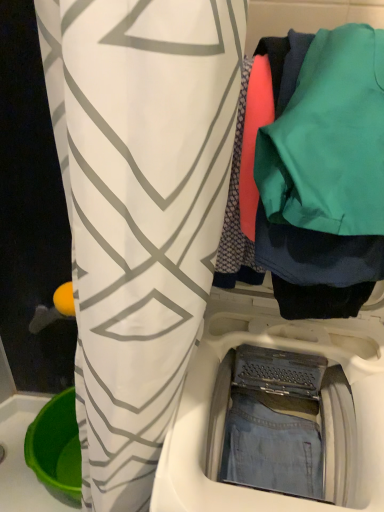
Question: Could you tell me if teal fabric at upper right is turned towards denim fabric washing machine at center?

Choices:
 (A) no
 (B) yes

Answer: (A)

Question: Considering the relative sizes of teal fabric at upper right and denim fabric washing machine at center in the image provided, is teal fabric at upper right taller than denim fabric washing machine at center?

Choices:
 (A) yes
 (B) no

Answer: (B)

Question: Can you confirm if teal fabric at upper right is thinner than denim fabric washing machine at center?

Choices:
 (A) no
 (B) yes

Answer: (B)

Question: Is teal fabric at upper right next to denim fabric washing machine at center?

Choices:
 (A) no
 (B) yes

Answer: (A)

Question: Considering the relative positions of teal fabric at upper right and denim fabric washing machine at center in the image provided, is teal fabric at upper right to the right of denim fabric washing machine at center from the viewer's perspective?

Choices:
 (A) no
 (B) yes

Answer: (B)

Question: Is teal fabric at upper right further to the viewer compared to denim fabric washing machine at center?

Choices:
 (A) no
 (B) yes

Answer: (A)

Question: From the image's perspective, is denim fabric washing machine at center over teal fabric at upper right?

Choices:
 (A) yes
 (B) no

Answer: (B)

Question: Considering the relative sizes of denim fabric washing machine at center and teal fabric at upper right in the image provided, is denim fabric washing machine at center shorter than teal fabric at upper right?

Choices:
 (A) yes
 (B) no

Answer: (B)

Question: Does denim fabric washing machine at center appear on the left side of teal fabric at upper right?

Choices:
 (A) yes
 (B) no

Answer: (A)

Question: Is denim fabric washing machine at center taller than teal fabric at upper right?

Choices:
 (A) no
 (B) yes

Answer: (B)

Question: Is denim fabric washing machine at center next to teal fabric at upper right and touching it?

Choices:
 (A) yes
 (B) no

Answer: (B)

Question: Does denim fabric washing machine at center appear on the right side of teal fabric at upper right?

Choices:
 (A) yes
 (B) no

Answer: (B)

Question: Is teal fabric at upper right wider or thinner than denim fabric washing machine at center?

Choices:
 (A) wide
 (B) thin

Answer: (B)